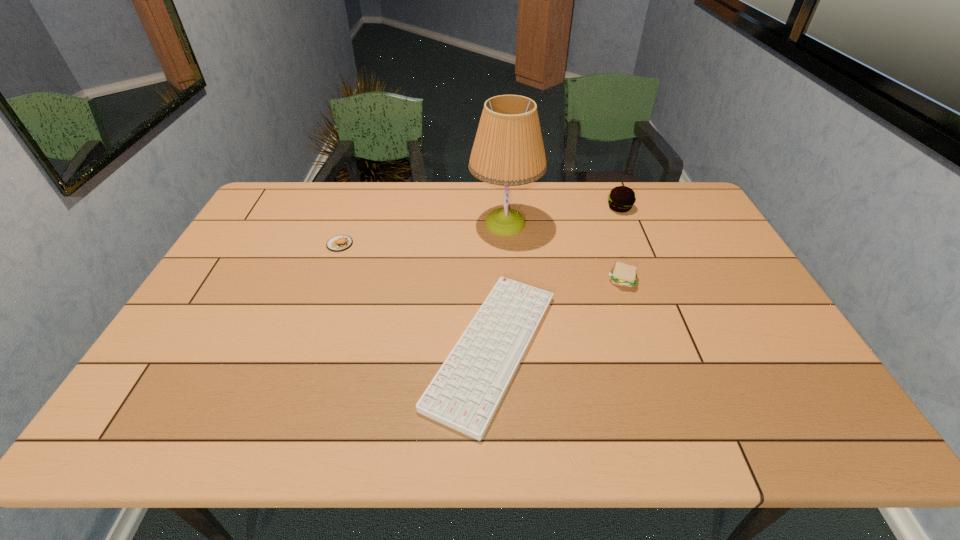
Where is `free area in between the computer keyboard and the second farthest patty`? The image size is (960, 540). free area in between the computer keyboard and the second farthest patty is located at coordinates (416, 296).

You are a GUI agent. You are given a task and a screenshot of the screen. Output one action in this format:
    pyautogui.click(x=<x>, y=<y>)
    Task: Click on the vacant space in between the tallest object and the nearest patty
    
    Given the screenshot: What is the action you would take?
    pyautogui.click(x=564, y=252)

Choose which object is the fourth nearest neighbor to the leftmost object. Please provide its 2D coordinates. Your answer should be formatted as a tuple, i.e. [(x, y)], where the tuple contains the x and y coordinates of a point satisfying the conditions above.

[(621, 198)]

Identify which object is the second nearest to the computer keyboard. Please provide its 2D coordinates. Your answer should be formatted as a tuple, i.e. [(x, y)], where the tuple contains the x and y coordinates of a point satisfying the conditions above.

[(508, 150)]

Choose which patty is the nearest neighbor to the leftmost patty. Please provide its 2D coordinates. Your answer should be formatted as a tuple, i.e. [(x, y)], where the tuple contains the x and y coordinates of a point satisfying the conditions above.

[(622, 274)]

This screenshot has height=540, width=960. I want to click on patty object that ranks as the second closest to the leftmost object, so click(x=621, y=198).

Where is `free space in the image that satisfies the following two spatial constraints: 1. on the side of the nearest patty near the pull switch; 2. on the right side of the tallest object`? The height and width of the screenshot is (540, 960). free space in the image that satisfies the following two spatial constraints: 1. on the side of the nearest patty near the pull switch; 2. on the right side of the tallest object is located at coordinates (509, 281).

You are a GUI agent. You are given a task and a screenshot of the screen. Output one action in this format:
    pyautogui.click(x=<x>, y=<y>)
    Task: Click on the vacant position in the image that satisfies the following two spatial constraints: 1. on the front side of the computer keyboard; 2. on the right side of the second farthest patty
    Image resolution: width=960 pixels, height=540 pixels.
    Given the screenshot: What is the action you would take?
    point(301,348)

The width and height of the screenshot is (960, 540). Find the location of `free location that satisfies the following two spatial constraints: 1. on the side of the nearest patty near the pull switch; 2. on the left side of the tallest object`. free location that satisfies the following two spatial constraints: 1. on the side of the nearest patty near the pull switch; 2. on the left side of the tallest object is located at coordinates (509, 281).